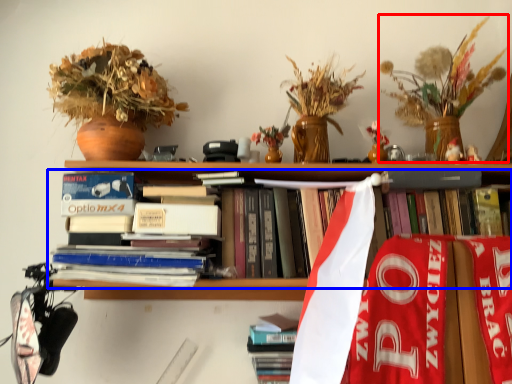
Question: Which object is closer to the camera taking this photo, floral arrangement (highlighted by a red box) or book (highlighted by a blue box)?

Choices:
 (A) floral arrangement
 (B) book

Answer: (A)